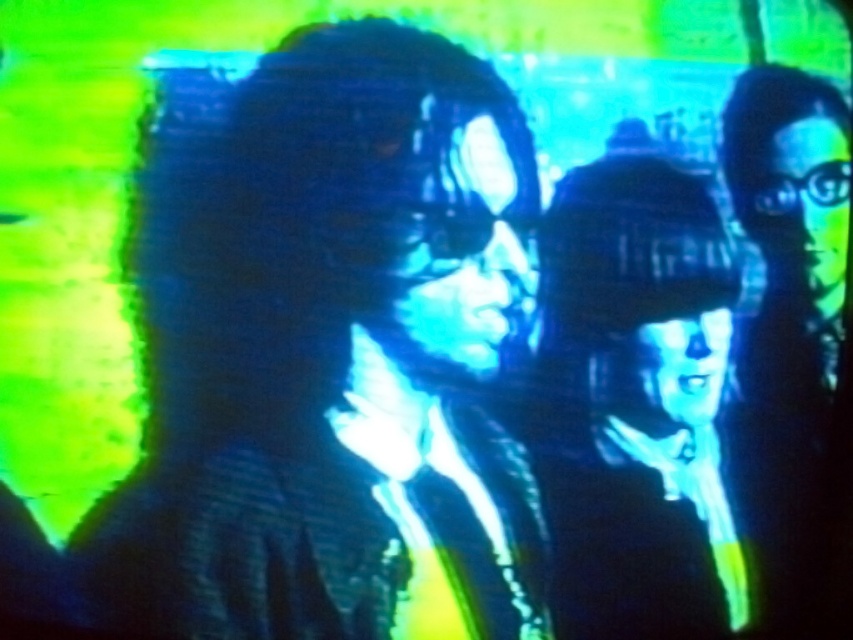
Is the position of matte black vr headset at center less distant than that of matte black glasses at right?

No, it is not.

Can you confirm if matte black vr headset at center is taller than matte black glasses at right?

Indeed, matte black vr headset at center has a greater height compared to matte black glasses at right.

Where is `matte black vr headset at center`? matte black vr headset at center is located at coordinates tap(635, 404).

Find the location of a particular element. Image resolution: width=853 pixels, height=640 pixels. matte black vr headset at center is located at coordinates (635, 404).